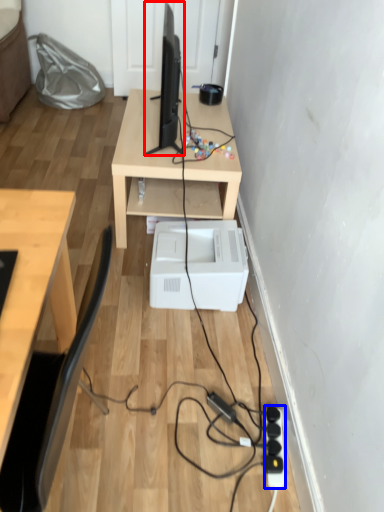
Question: Which point is further to the camera, desktop computer (highlighted by a red box) or extension cord (highlighted by a blue box)?

Choices:
 (A) desktop computer
 (B) extension cord

Answer: (A)